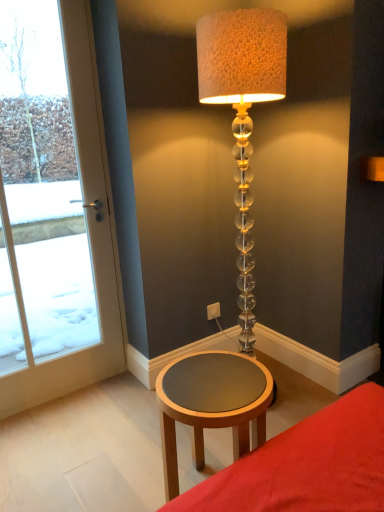
Question: Is matte brown table at lower center to the left or to the right of translucent glass lamp at center in the image?

Choices:
 (A) left
 (B) right

Answer: (B)

Question: Choose the correct answer: Is matte brown table at lower center inside translucent glass lamp at center or outside it?

Choices:
 (A) inside
 (B) outside

Answer: (B)

Question: Which object is positioned farthest from the translucent glass lamp at center?

Choices:
 (A) white glass door at left
 (B) wooden round table at lower center
 (C) white plastic electric outlet at lower center
 (D) matte brown table at lower center

Answer: (A)

Question: Which object is positioned closest to the white plastic electric outlet at lower center?

Choices:
 (A) wooden round table at lower center
 (B) white glass door at left
 (C) matte brown table at lower center
 (D) translucent glass lamp at center

Answer: (A)